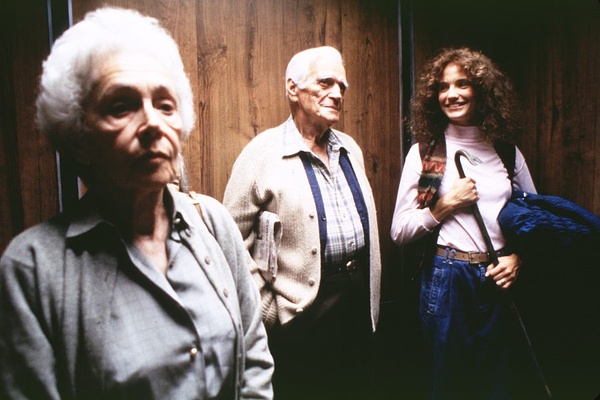
The height and width of the screenshot is (400, 600). What are the coordinates of `brown wood panel` in the screenshot? It's located at (382, 52).